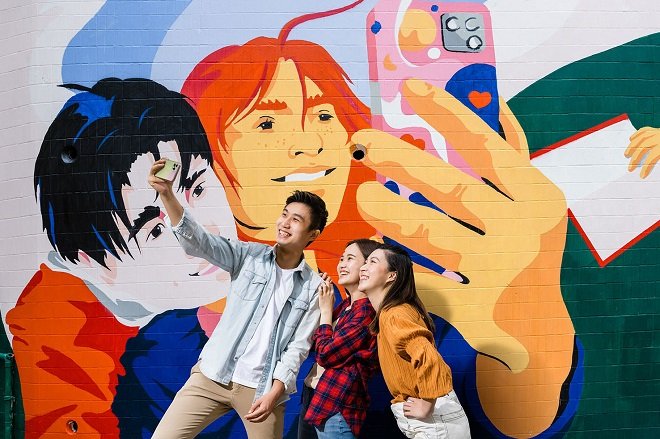
Where is `1 phone`? This screenshot has width=660, height=439. 1 phone is located at coordinates (170, 170).